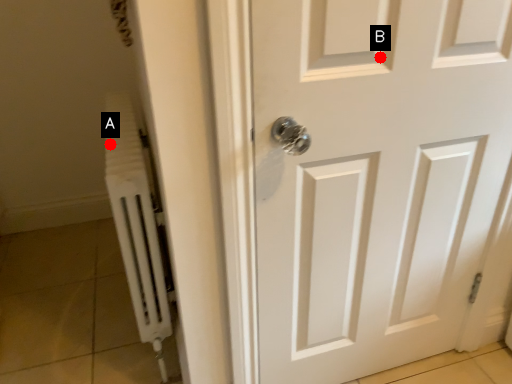
Question: Two points are circled on the image, labeled by A and B beside each circle. Among these points, which one is nearest to the camera?

Choices:
 (A) A is closer
 (B) B is closer

Answer: (B)